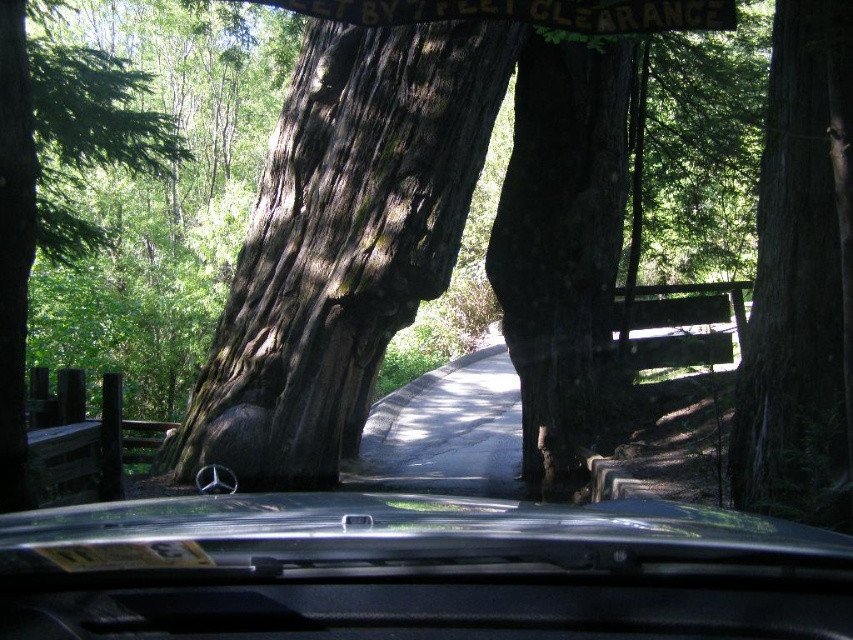
You are driving a car and want to know if your car can pass through a narrow section of the road ahead. You see a black metallic car at center and a dark brown textured bark at center in your view. Which object is wider, and does this indicate your car can fit through the narrow section?

The black metallic car at center is narrower than the dark brown textured bark at center. Since your car is the same width as the black metallic car at center, it should be able to fit through the narrow section as it is narrower than the bark, which likely marks the edge of the road.

You are driving a car and want to know if there is enough space to safely pass between the black metallic car at center and the dark brown textured bark at center. Can you determine if there is enough space based on the distance provided?

The distance between the black metallic car at center and the dark brown textured bark at center is 17.47 feet, which is sufficient for a car to pass safely as it exceeds the typical width required for a vehicle.

You are driving a car and want to know if the point at coordinate point (758,186) is closer to you than the point at coordinate point (15,33). Based on the scene, can you determine which point is closer?

Point (758,186) is further to the viewer than point (15,33), so the point at point (15,33) is closer to you.